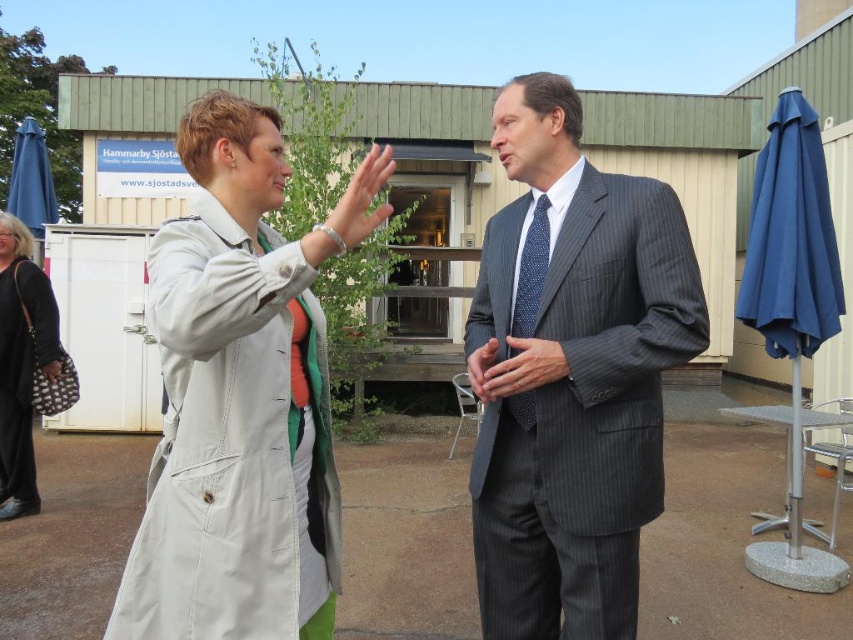
Can you confirm if blue fabric umbrella at right is positioned below matte black handbag at lower left?

Incorrect, blue fabric umbrella at right is not positioned below matte black handbag at lower left.

Does blue fabric umbrella at right appear on the left side of matte black handbag at lower left?

In fact, blue fabric umbrella at right is to the right of matte black handbag at lower left.

Who is more forward, (805, 282) or (61, 369)?

Point (805, 282) is more forward.

This screenshot has height=640, width=853. Identify the location of blue fabric umbrella at right. click(791, 264).

Is the position of light beige trench coat at center less distant than that of matte black handbag at lower left?

Yes, it is.

Does light beige trench coat at center have a larger size compared to matte black handbag at lower left?

Yes, light beige trench coat at center is bigger than matte black handbag at lower left.

At what (x,y) coordinates should I click in order to perform the action: click on light beige trench coat at center. Please return your answer as a coordinate pair (x, y). Looking at the image, I should click on (235, 406).

Can you confirm if light beige fabric hand at center is bigger than smooth gray suit at center?

Yes.

Does light beige fabric hand at center lie in front of smooth gray suit at center?

That is True.

Identify the location of light beige fabric hand at center. The height and width of the screenshot is (640, 853). (357, 205).